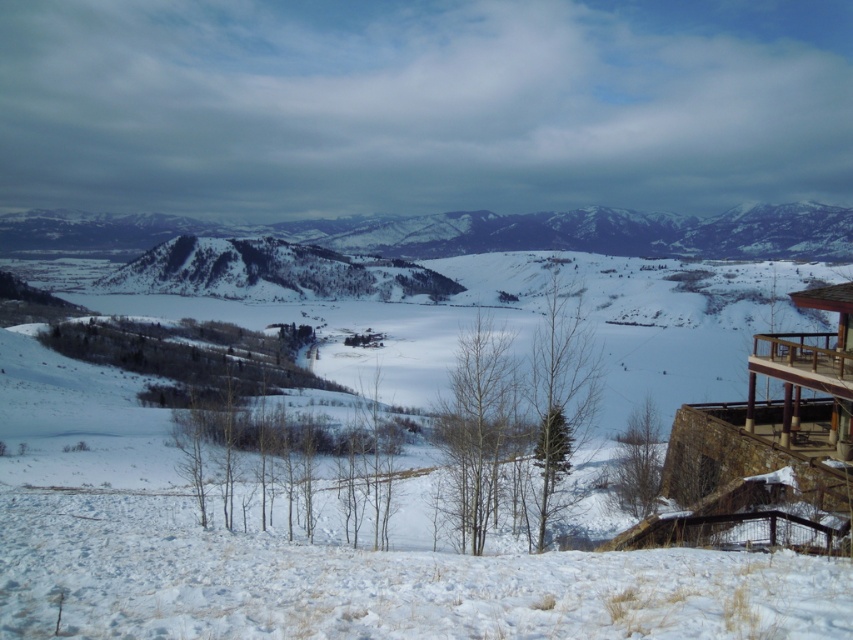
Question: Is snowy textured mountain at center wider than brown wooden balcony at lower right?

Choices:
 (A) no
 (B) yes

Answer: (B)

Question: Which point appears farthest from the camera in this image?

Choices:
 (A) (831, 360)
 (B) (444, 232)

Answer: (B)

Question: Can you confirm if snowy textured mountain at center is wider than brown wooden balcony at lower right?

Choices:
 (A) no
 (B) yes

Answer: (B)

Question: Among these objects, which one is nearest to the camera?

Choices:
 (A) brown wooden balcony at lower right
 (B) snowy textured mountain at center

Answer: (A)

Question: Does snowy textured mountain at center appear on the left side of brown wooden balcony at lower right?

Choices:
 (A) yes
 (B) no

Answer: (A)